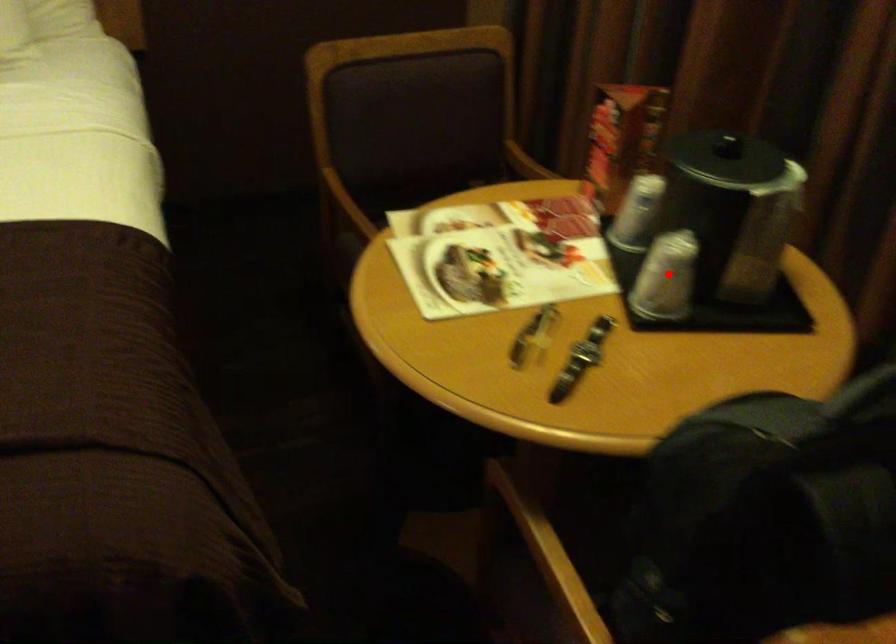
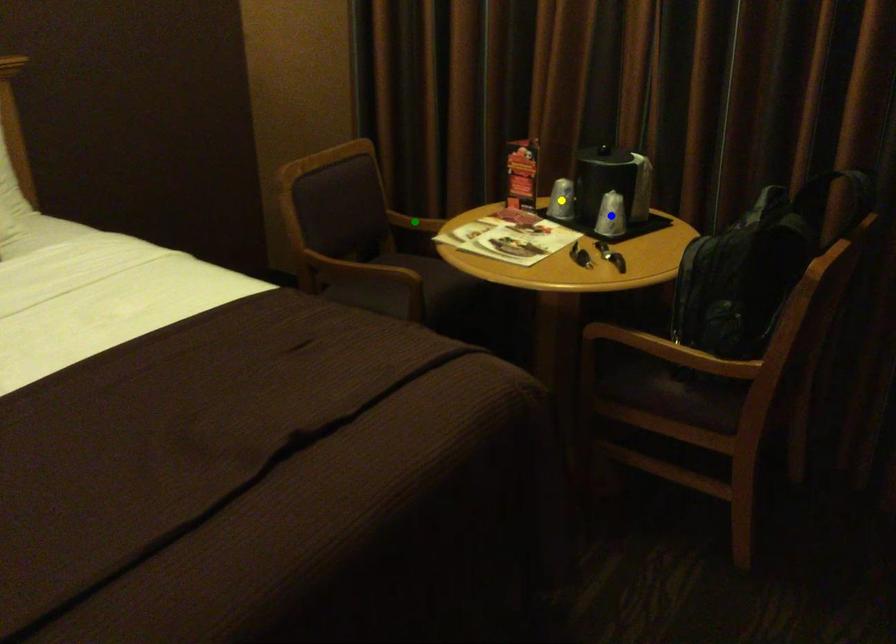
Question: I am providing you with two images of the same scene from different viewpoints. A red point is marked on the first image. You are given multiple points on the second image. Which point in image 2 is actually the same real-world point as the red point in image 1?

Choices:
 (A) blue point
 (B) green point
 (C) yellow point

Answer: (A)